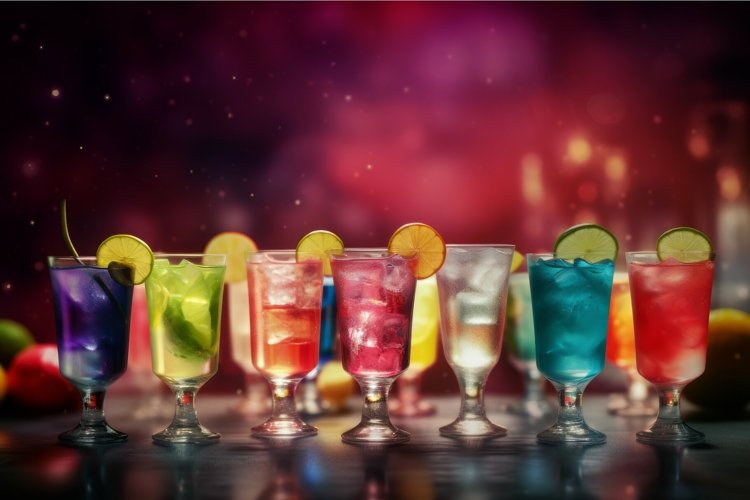
You are a GUI agent. You are given a task and a screenshot of the screen. Output one action in this format:
    pyautogui.click(x=<x>, y=<y>)
    Task: Click on the reflected counter
    This screenshot has width=750, height=500.
    Given the screenshot: What is the action you would take?
    pyautogui.click(x=412, y=462)